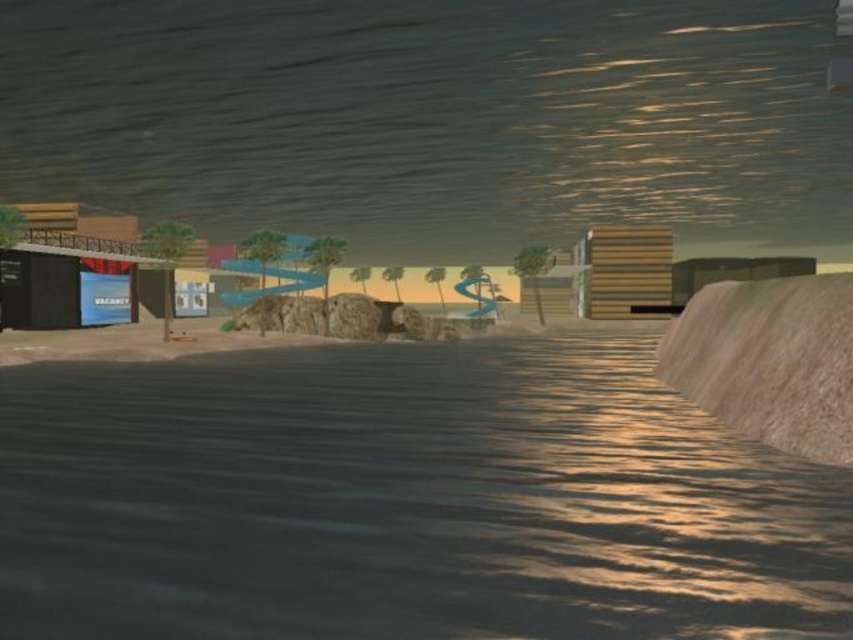
Question: Does rustic wood ramp at right appear on the right side of blue glossy sign at lower left?

Choices:
 (A) yes
 (B) no

Answer: (A)

Question: Is rustic wood ramp at right smaller than blue glossy sign at lower left?

Choices:
 (A) yes
 (B) no

Answer: (B)

Question: Which of the following is the closest to the observer?

Choices:
 (A) (125, 275)
 (B) (685, 388)

Answer: (B)

Question: Is rustic wood ramp at right bigger than blue glossy sign at lower left?

Choices:
 (A) yes
 (B) no

Answer: (A)